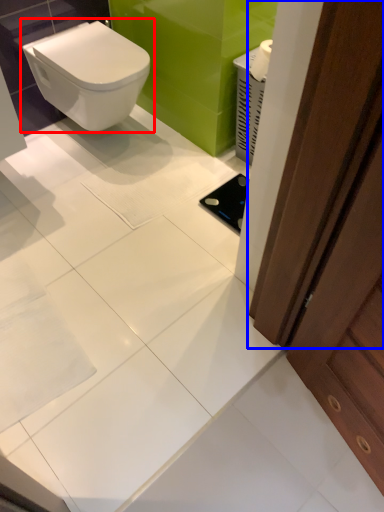
Question: Which object appears farthest to the camera in this image, toilet (highlighted by a red box) or screen door (highlighted by a blue box)?

Choices:
 (A) toilet
 (B) screen door

Answer: (A)